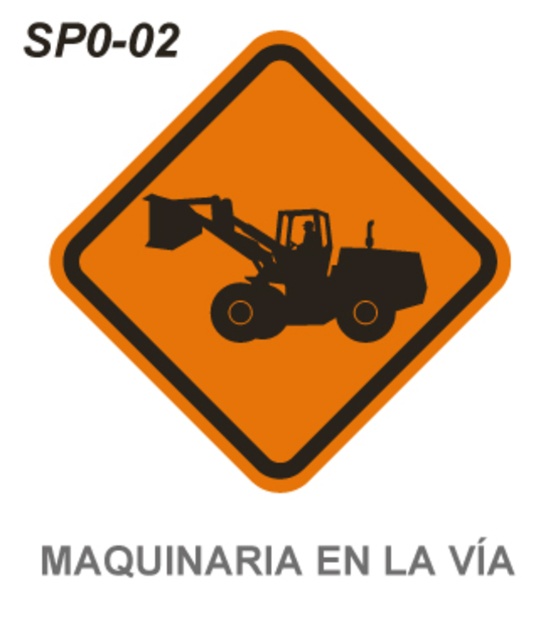
Can you confirm if orange matte/black textured construction equipment at center is bigger than black silhouette tractor at center?

Yes, orange matte/black textured construction equipment at center is bigger than black silhouette tractor at center.

Which of these two, orange matte/black textured construction equipment at center or black silhouette tractor at center, stands taller?

With more height is orange matte/black textured construction equipment at center.

Locate an element on the screen. The width and height of the screenshot is (558, 640). orange matte/black textured construction equipment at center is located at coordinates (280, 260).